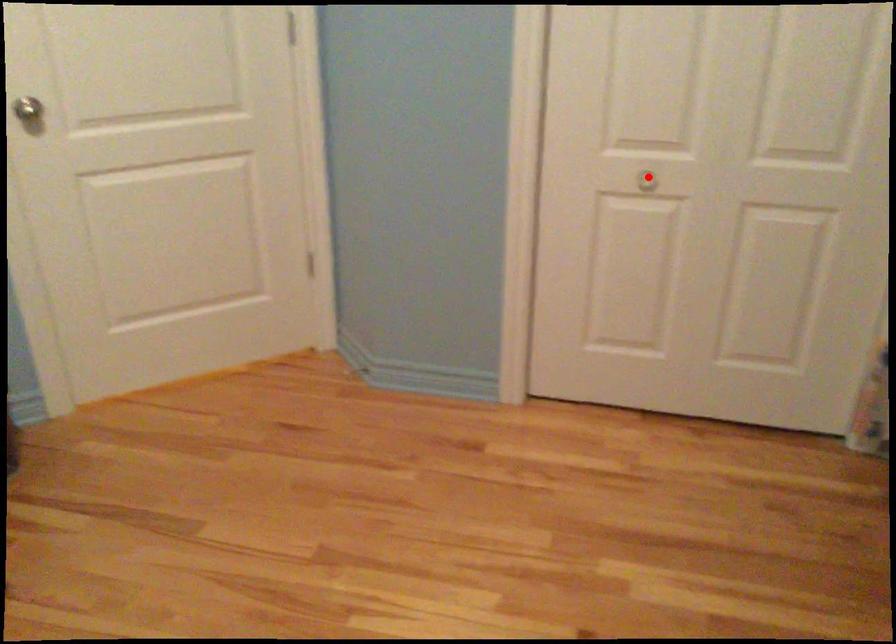
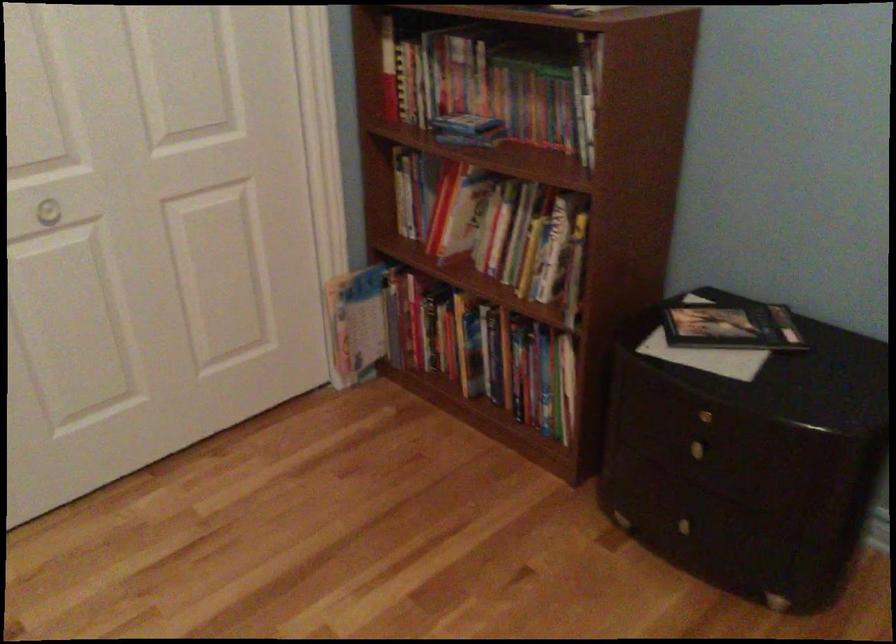
Question: I am providing you with two images of the same scene from different viewpoints. A red point is shown in image1. For the corresponding object point in image2, is it positioned nearer or farther from the camera?

Choices:
 (A) Nearer
 (B) Farther

Answer: (A)